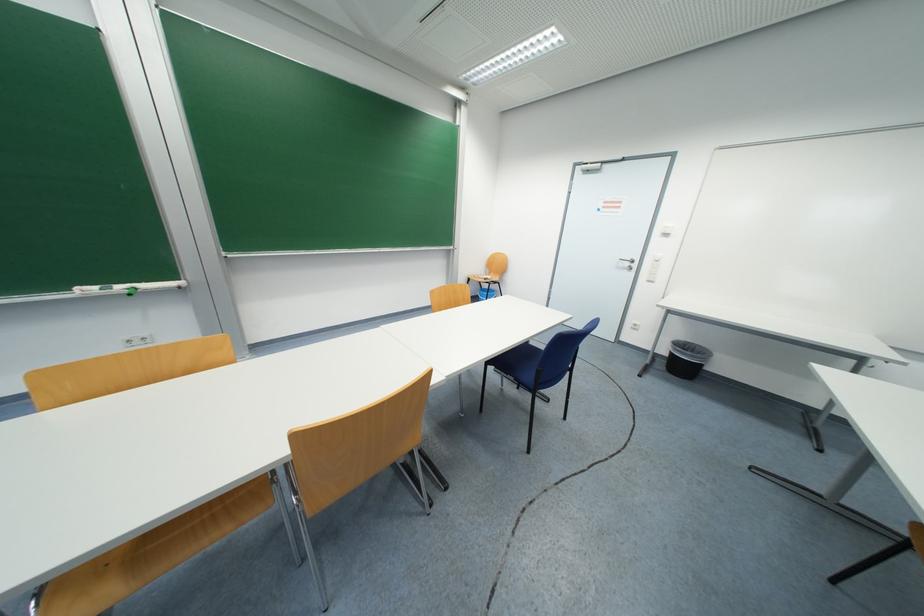
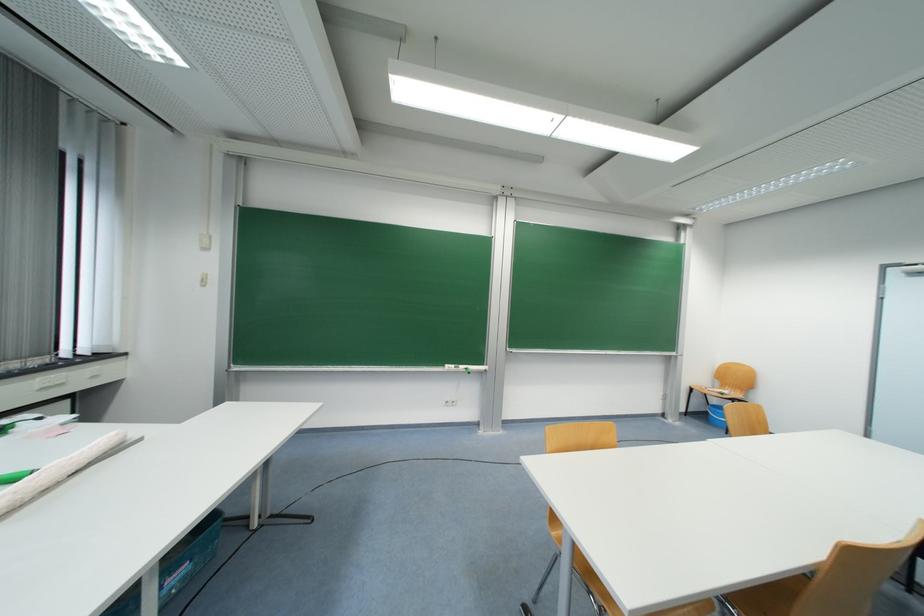
Where in the second image is the point corresponding to the point at 126,289 from the first image?

(467, 369)